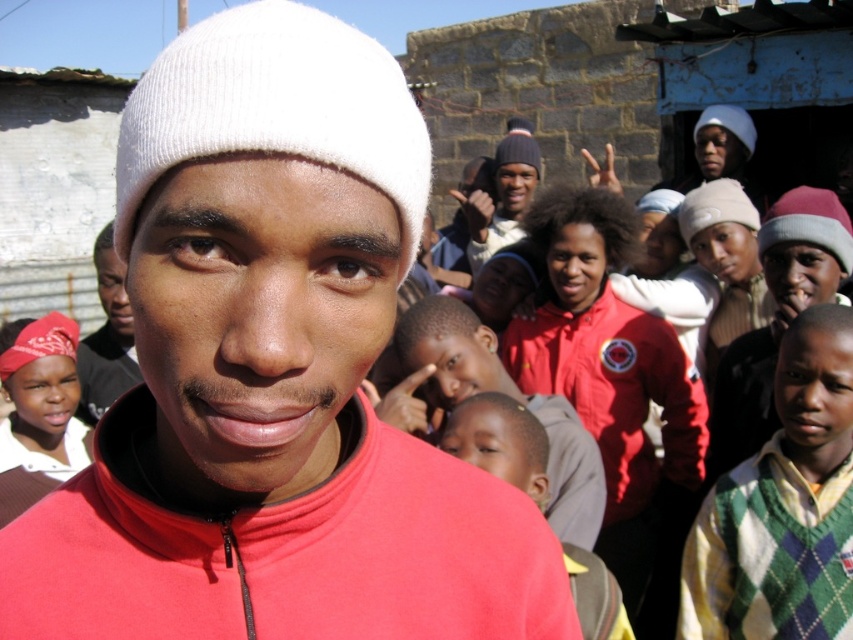
Looking at this image, between matte red bandana at lower left and smooth skin child at center, which one has less height?

smooth skin child at center

Is point (25, 358) behind point (584, 621)?

That is True.

Describe the element at coordinates (39, 413) in the screenshot. I see `matte red bandana at lower left` at that location.

Locate an element on the screen. The height and width of the screenshot is (640, 853). matte red bandana at lower left is located at coordinates (39, 413).

Is green argyle sweater at right in front of matte red bandana at lower left?

Yes, green argyle sweater at right is in front of matte red bandana at lower left.

Can you confirm if green argyle sweater at right is thinner than matte red bandana at lower left?

No, green argyle sweater at right is not thinner than matte red bandana at lower left.

The height and width of the screenshot is (640, 853). What are the coordinates of `green argyle sweater at right` in the screenshot? It's located at (782, 506).

Can you confirm if matte red jacket at center is taller than green argyle sweater at right?

No, matte red jacket at center is not taller than green argyle sweater at right.

Which of these two, matte red jacket at center or green argyle sweater at right, stands taller?

Standing taller between the two is green argyle sweater at right.

Is point (300, 304) closer to camera compared to point (723, 637)?

Yes.

Where is `matte red jacket at center`? matte red jacket at center is located at coordinates (271, 376).